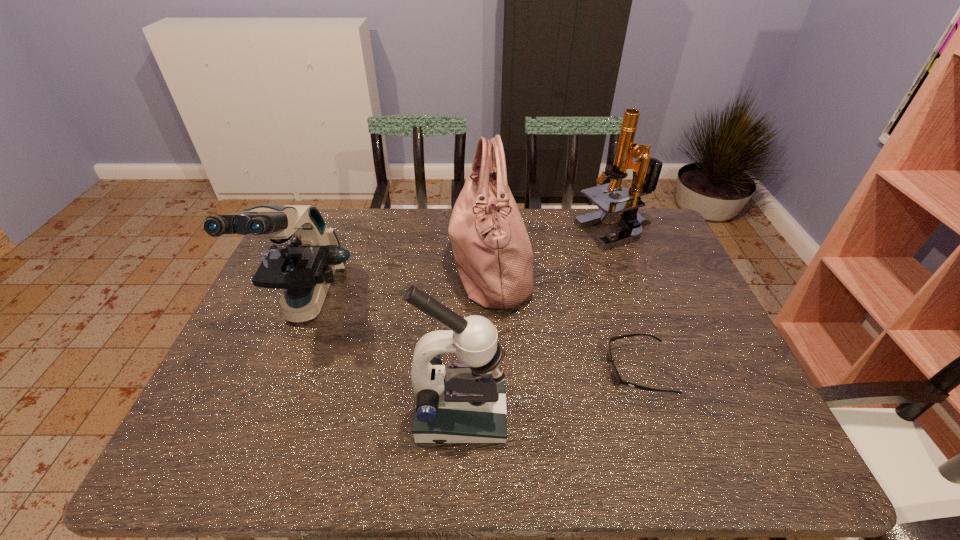
Find the location of `vacant area situated 0.330m at the eyepiece of the rightmost microscope`. vacant area situated 0.330m at the eyepiece of the rightmost microscope is located at coordinates (478, 232).

Identify the location of vacant area situated at the eyepiece of the rightmost microscope. (490, 232).

Where is `vacant space located through the eyepieces of the second nearest microscope`? vacant space located through the eyepieces of the second nearest microscope is located at coordinates (265, 406).

Find the location of `vacant space positioned 0.400m on the back of the second microscope from right to left`. vacant space positioned 0.400m on the back of the second microscope from right to left is located at coordinates click(466, 272).

Identify the location of vacant space situated 0.330m on the front-facing side of the sunglasses. (471, 369).

The width and height of the screenshot is (960, 540). In order to click on free space located 0.230m on the front-facing side of the sunglasses in this screenshot , I will do `click(513, 369)`.

Where is `free space located 0.240m on the front-facing side of the sunglasses`? free space located 0.240m on the front-facing side of the sunglasses is located at coordinates (509, 369).

At what (x,y) coordinates should I click in order to perform the action: click on handbag present at the far edge. Please return your answer as a coordinate pair (x, y). This screenshot has height=540, width=960. Looking at the image, I should click on (493, 255).

Where is `microscope present at the far edge`? This screenshot has height=540, width=960. microscope present at the far edge is located at coordinates (646, 170).

This screenshot has width=960, height=540. In order to click on object situated at the near edge in this screenshot , I will do `click(465, 403)`.